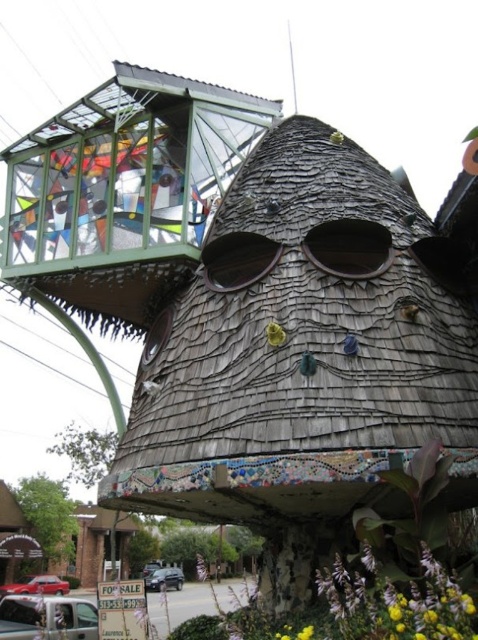
You are standing at the entrance of the fantastical house and see the shiny red sedan at lower left and the metallic silver car at lower center. Which car is closer to you?

The shiny red sedan at lower left is closer to you because it is in front of the metallic silver car at lower center.

You are standing at the center of the image. Which direction should you look to see the silver metallic van at lower left?

You should look to the lower left direction to see the silver metallic van at lower left.